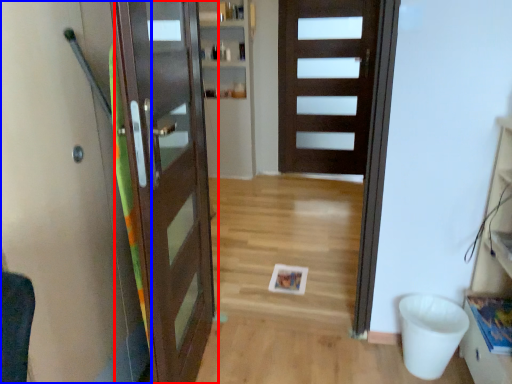
Question: Among these objects, which one is farthest to the camera, door (highlighted by a red box) or elevator (highlighted by a blue box)?

Choices:
 (A) door
 (B) elevator

Answer: (A)